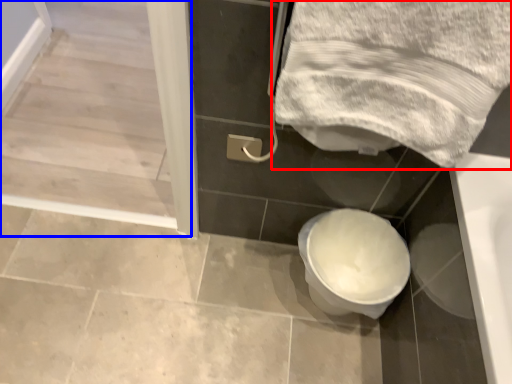
Question: Among these objects, which one is farthest to the camera, towel (highlighted by a red box) or screen door (highlighted by a blue box)?

Choices:
 (A) towel
 (B) screen door

Answer: (B)